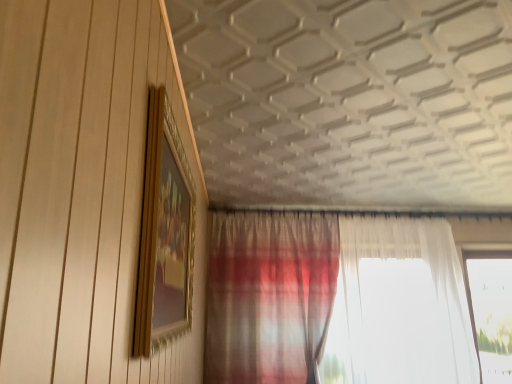
Where is `transparent glass window at right`? transparent glass window at right is located at coordinates (490, 298).

Where is `transparent glass window at right`? This screenshot has height=384, width=512. transparent glass window at right is located at coordinates (490, 298).

From the image's perspective, which one is positioned lower, transparent glass window at right or plaid fabric curtain at lower center?

transparent glass window at right is shown below in the image.

Between point (471, 314) and point (396, 256), which one is positioned behind?

Point (471, 314)

Is transparent glass window at right in front of plaid fabric curtain at lower center?

No, transparent glass window at right is further to the viewer.

Identify the location of window below the plaid fabric curtain at lower center (from the image's perspective). (490, 298).

Image resolution: width=512 pixels, height=384 pixels. In order to click on picture frame above the plaid fabric curtain at lower center (from the image's perspective) in this screenshot , I will do `click(164, 233)`.

Who is shorter, plaid fabric curtain at lower center or gold/gilded picture frame at upper left?

Standing shorter between the two is gold/gilded picture frame at upper left.

Which of these two, plaid fabric curtain at lower center or gold/gilded picture frame at upper left, is bigger?

Bigger between the two is plaid fabric curtain at lower center.

Image resolution: width=512 pixels, height=384 pixels. In the image, there is a plaid fabric curtain at lower center. Find the location of `window below it (from a real-world perspective)`. window below it (from a real-world perspective) is located at coordinates (490, 298).

Between point (343, 365) and point (476, 333), which one is positioned in front?

The point (343, 365) is closer to the camera.

Based on the photo, is transparent glass window at right a part of plaid fabric curtain at lower center?

No, plaid fabric curtain at lower center does not contain transparent glass window at right.

From the image's perspective, is plaid fabric curtain at lower center under transparent glass window at right?

Incorrect, from the image's perspective, plaid fabric curtain at lower center is higher than transparent glass window at right.

Does point (153, 245) come farther from viewer compared to point (493, 317)?

No, (153, 245) is closer to viewer.

Would you say gold/gilded picture frame at upper left contains transparent glass window at right?

No.

In the image, is gold/gilded picture frame at upper left positioned in front of or behind transparent glass window at right?

In the image, gold/gilded picture frame at upper left appears in front of transparent glass window at right.

Looking at this image, is gold/gilded picture frame at upper left far from transparent glass window at right?

Yes, gold/gilded picture frame at upper left is far from transparent glass window at right.

From a real-world perspective, is gold/gilded picture frame at upper left physically located above or below plaid fabric curtain at lower center?

gold/gilded picture frame at upper left is above plaid fabric curtain at lower center.

Between gold/gilded picture frame at upper left and plaid fabric curtain at lower center, which one has larger size?

Bigger between the two is plaid fabric curtain at lower center.

Locate an element on the screen. The image size is (512, 384). picture frame lying above the plaid fabric curtain at lower center (from the image's perspective) is located at coordinates click(x=164, y=233).

Based on the photo, are gold/gilded picture frame at upper left and plaid fabric curtain at lower center beside each other?

gold/gilded picture frame at upper left and plaid fabric curtain at lower center are clearly separated.

Between point (490, 334) and point (163, 135), which one is positioned behind?

Point (490, 334)

Considering the positions of objects transparent glass window at right and gold/gilded picture frame at upper left in the image provided, who is in front, transparent glass window at right or gold/gilded picture frame at upper left?

gold/gilded picture frame at upper left is closer to the camera.

From a real-world perspective, is transparent glass window at right on top of gold/gilded picture frame at upper left?

Incorrect, from a real-world perspective, transparent glass window at right is lower than gold/gilded picture frame at upper left.

Image resolution: width=512 pixels, height=384 pixels. Identify the location of window behind the plaid fabric curtain at lower center. (490, 298).

This screenshot has width=512, height=384. What are the coordinates of `curtain located underneath the gold/gilded picture frame at upper left (from a real-world perspective)` in the screenshot? It's located at (336, 301).

Based on their spatial positions, is transparent glass window at right or gold/gilded picture frame at upper left further from plaid fabric curtain at lower center?

The object further to plaid fabric curtain at lower center is gold/gilded picture frame at upper left.

Which object lies nearer to the anchor point transparent glass window at right, gold/gilded picture frame at upper left or plaid fabric curtain at lower center?

plaid fabric curtain at lower center is positioned closer to the anchor transparent glass window at right.

Looking at the image, which one is located closer to plaid fabric curtain at lower center, gold/gilded picture frame at upper left or transparent glass window at right?

transparent glass window at right lies closer to plaid fabric curtain at lower center than the other object.

Considering their positions, is plaid fabric curtain at lower center positioned closer to transparent glass window at right than gold/gilded picture frame at upper left?

plaid fabric curtain at lower center is closer to transparent glass window at right.

Based on their spatial positions, is transparent glass window at right or plaid fabric curtain at lower center further from gold/gilded picture frame at upper left?

transparent glass window at right lies further to gold/gilded picture frame at upper left than the other object.

When comparing their distances from gold/gilded picture frame at upper left, does plaid fabric curtain at lower center or transparent glass window at right seem closer?

The object closer to gold/gilded picture frame at upper left is plaid fabric curtain at lower center.

This screenshot has height=384, width=512. In order to click on curtain between gold/gilded picture frame at upper left and transparent glass window at right in the front-back direction in this screenshot , I will do `click(336, 301)`.